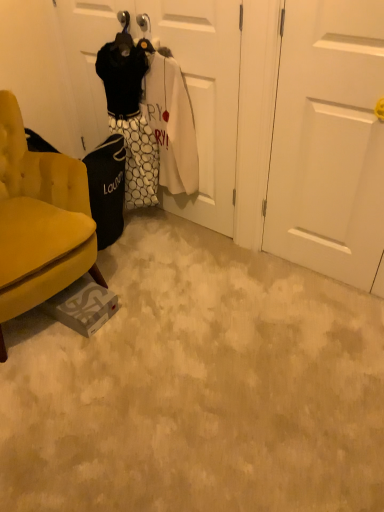
Describe the element at coordinates (184, 78) in the screenshot. I see `white matte door at center, which ranks as the 2th door in right-to-left order` at that location.

Identify the location of white matte door at center, marked as the 1th door in a right-to-left arrangement. (329, 141).

The width and height of the screenshot is (384, 512). What do you see at coordinates (39, 221) in the screenshot?
I see `velvet yellow armchair at lower left` at bounding box center [39, 221].

I want to click on white matte door at center, which ranks as the 2th door in right-to-left order, so click(184, 78).

Would you say velvet yellow armchair at lower left is a long distance from white matte door at center, which is the 1th door in left-to-right order?

That's not correct — velvet yellow armchair at lower left is a little close to white matte door at center, which is the 1th door in left-to-right order.

Which object is closer to the camera, velvet yellow armchair at lower left or white matte door at center, which ranks as the 2th door in right-to-left order?

velvet yellow armchair at lower left is closer to the camera.

Which of these two, velvet yellow armchair at lower left or white matte door at center, which is the 1th door in left-to-right order, is thinner?

white matte door at center, which is the 1th door in left-to-right order.

From the image's perspective, who appears lower, velvet yellow armchair at lower left or white matte door at center, which is the 1th door in left-to-right order?

velvet yellow armchair at lower left.

From the image's perspective, is white matte door at center, marked as the 1th door in a right-to-left arrangement, located above velvet yellow armchair at lower left?

Yes.

Would you say white matte door at center, marked as the 1th door in a right-to-left arrangement, contains velvet yellow armchair at lower left?

No, white matte door at center, marked as the 1th door in a right-to-left arrangement, does not contain velvet yellow armchair at lower left.

Is point (301, 14) farther from camera compared to point (46, 222)?

No, it is in front of (46, 222).

Is white matte door at center, marked as the 1th door in a right-to-left arrangement, at the back of white matte door at center, which is the 1th door in left-to-right order?

That's not correct — white matte door at center, which is the 1th door in left-to-right order, is not looking away from white matte door at center, marked as the 1th door in a right-to-left arrangement.

Which is more to the right, white matte door at center, which is the 1th door in left-to-right order, or white matte door at center, marked as the 1th door in a right-to-left arrangement?

white matte door at center, marked as the 1th door in a right-to-left arrangement, is more to the right.

Is the depth of white matte door at center, which is the 1th door in left-to-right order, less than that of white matte door at center, marked as the 1th door in a right-to-left arrangement?

No, it is behind white matte door at center, marked as the 1th door in a right-to-left arrangement.

Considering the relative sizes of white matte door at center, marked as the 1th door in a right-to-left arrangement, and white matte door at center, which is the 1th door in left-to-right order, in the image provided, is white matte door at center, marked as the 1th door in a right-to-left arrangement, bigger than white matte door at center, which is the 1th door in left-to-right order,?

Actually, white matte door at center, marked as the 1th door in a right-to-left arrangement, might be smaller than white matte door at center, which is the 1th door in left-to-right order.

Considering the positions of objects white matte door at center, marked as the 1th door in a right-to-left arrangement, and white matte door at center, which is the 1th door in left-to-right order, in the image provided, who is more to the right, white matte door at center, marked as the 1th door in a right-to-left arrangement, or white matte door at center, which is the 1th door in left-to-right order,?

white matte door at center, marked as the 1th door in a right-to-left arrangement, is more to the right.

Does point (345, 265) lie behind point (200, 16)?

Yes, it is behind point (200, 16).

Looking at this image, which object is further away from the camera, white matte door at center, which ranks as the 2th door in right-to-left order, or velvet yellow armchair at lower left?

white matte door at center, which ranks as the 2th door in right-to-left order, is more distant.

Considering the relative positions of white matte door at center, which ranks as the 2th door in right-to-left order, and velvet yellow armchair at lower left in the image provided, is white matte door at center, which ranks as the 2th door in right-to-left order, to the left of velvet yellow armchair at lower left from the viewer's perspective?

In fact, white matte door at center, which ranks as the 2th door in right-to-left order, is to the right of velvet yellow armchair at lower left.

Measure the distance from white matte door at center, which ranks as the 2th door in right-to-left order, to velvet yellow armchair at lower left.

They are 28.87 inches apart.

Is white matte door at center, which is the 1th door in left-to-right order, taller or shorter than velvet yellow armchair at lower left?

In the image, white matte door at center, which is the 1th door in left-to-right order, appears to be taller than velvet yellow armchair at lower left.

Considering the sizes of objects velvet yellow armchair at lower left and white matte door at center, marked as the 1th door in a right-to-left arrangement, in the image provided, who is smaller, velvet yellow armchair at lower left or white matte door at center, marked as the 1th door in a right-to-left arrangement,?

white matte door at center, marked as the 1th door in a right-to-left arrangement, is smaller.

Is white matte door at center, marked as the 1th door in a right-to-left arrangement, a part of velvet yellow armchair at lower left?

No, white matte door at center, marked as the 1th door in a right-to-left arrangement, is not surrounded by velvet yellow armchair at lower left.

Between velvet yellow armchair at lower left and white matte door at center, which appears as the second door when viewed from the left, which one has smaller width?

With smaller width is white matte door at center, which appears as the second door when viewed from the left.

Is velvet yellow armchair at lower left oriented away from white matte door at center, which appears as the second door when viewed from the left?

No, velvet yellow armchair at lower left's orientation is not away from white matte door at center, which appears as the second door when viewed from the left.

I want to click on door that is the 1st object to the right of the velvet yellow armchair at lower left, starting at the anchor, so click(x=184, y=78).

Identify the location of chair on the left of white matte door at center, marked as the 1th door in a right-to-left arrangement. (39, 221).

Considering their positions, is white matte door at center, which is the 1th door in left-to-right order, positioned closer to velvet yellow armchair at lower left than white matte door at center, marked as the 1th door in a right-to-left arrangement?

white matte door at center, which is the 1th door in left-to-right order, lies closer to velvet yellow armchair at lower left than the other object.

Based on their spatial positions, is white matte door at center, which is the 1th door in left-to-right order, or velvet yellow armchair at lower left further from white matte door at center, which appears as the second door when viewed from the left?

velvet yellow armchair at lower left is further to white matte door at center, which appears as the second door when viewed from the left.

Based on their spatial positions, is velvet yellow armchair at lower left or white matte door at center, which is the 1th door in left-to-right order, further from white matte door at center, marked as the 1th door in a right-to-left arrangement?

Among the two, velvet yellow armchair at lower left is located further to white matte door at center, marked as the 1th door in a right-to-left arrangement.

Estimate the real-world distances between objects in this image. Which object is closer to white matte door at center, which ranks as the 2th door in right-to-left order, white matte door at center, which appears as the second door when viewed from the left, or velvet yellow armchair at lower left?

white matte door at center, which appears as the second door when viewed from the left, is positioned closer to the anchor white matte door at center, which ranks as the 2th door in right-to-left order.

When comparing their distances from velvet yellow armchair at lower left, does white matte door at center, which appears as the second door when viewed from the left, or white matte door at center, which is the 1th door in left-to-right order, seem closer?

white matte door at center, which is the 1th door in left-to-right order, is positioned closer to the anchor velvet yellow armchair at lower left.

Based on their spatial positions, is velvet yellow armchair at lower left or white matte door at center, which appears as the second door when viewed from the left, closer to white matte door at center, which is the 1th door in left-to-right order?

white matte door at center, which appears as the second door when viewed from the left, is closer to white matte door at center, which is the 1th door in left-to-right order.

Where is `door between velvet yellow armchair at lower left and white matte door at center, marked as the 1th door in a right-to-left arrangement`? This screenshot has width=384, height=512. door between velvet yellow armchair at lower left and white matte door at center, marked as the 1th door in a right-to-left arrangement is located at coordinates (184, 78).